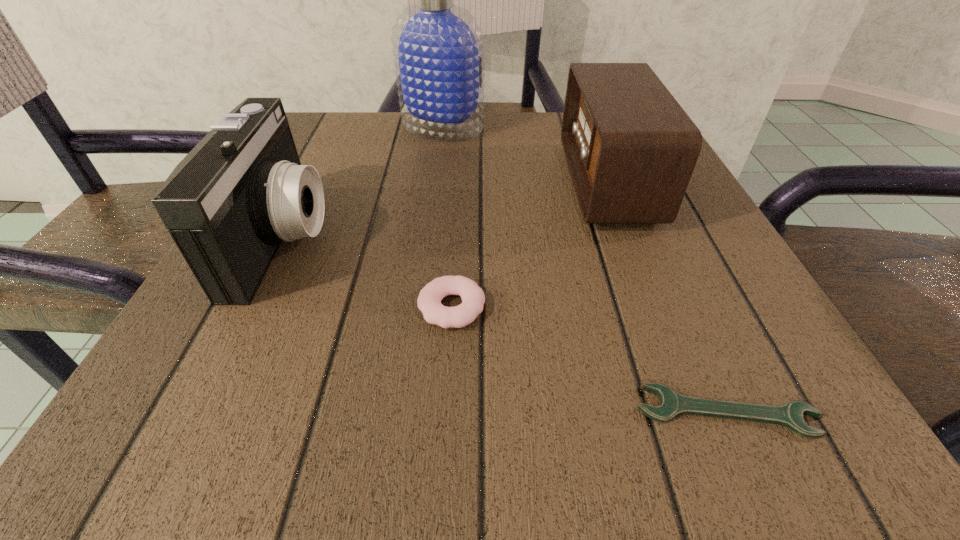
In order to click on free space that satisfies the following two spatial constraints: 1. on the lens of the second shortest object; 2. on the right side of the leftmost object in this screenshot , I will do `click(249, 307)`.

Identify the location of free space that satisfies the following two spatial constraints: 1. on the lens of the fourth tallest object; 2. on the left side of the camcorder. (249, 307).